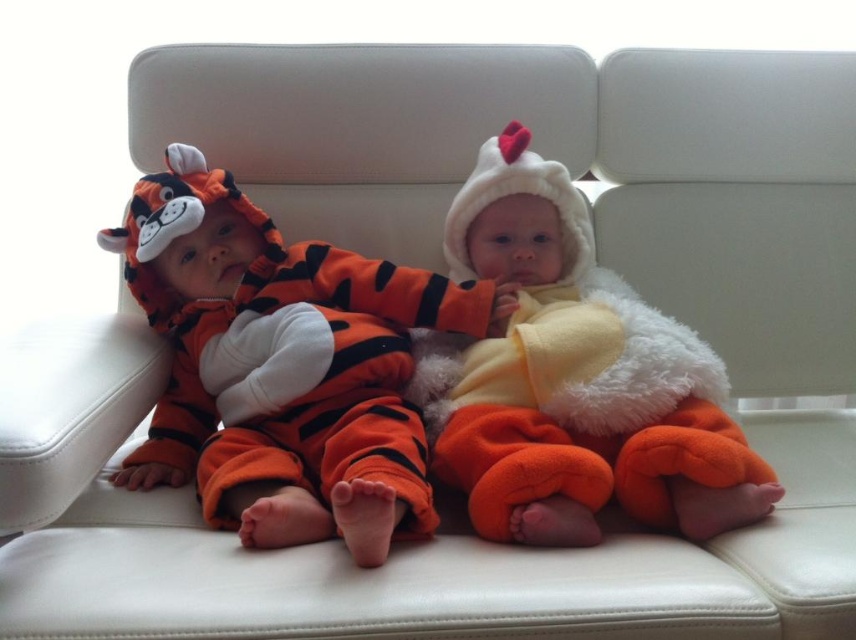
Question: Does orange fuzzy tiger suit at left come in front of fluffy orange chicken at center?

Choices:
 (A) yes
 (B) no

Answer: (A)

Question: Which point appears closest to the camera in this image?

Choices:
 (A) (610, 291)
 (B) (141, 198)

Answer: (B)

Question: Which point is closer to the camera?

Choices:
 (A) (383, 536)
 (B) (508, 422)

Answer: (A)

Question: Does orange fuzzy tiger suit at left have a lesser width compared to fluffy orange chicken at center?

Choices:
 (A) yes
 (B) no

Answer: (B)

Question: Is orange fuzzy tiger suit at left smaller than fluffy orange chicken at center?

Choices:
 (A) no
 (B) yes

Answer: (A)